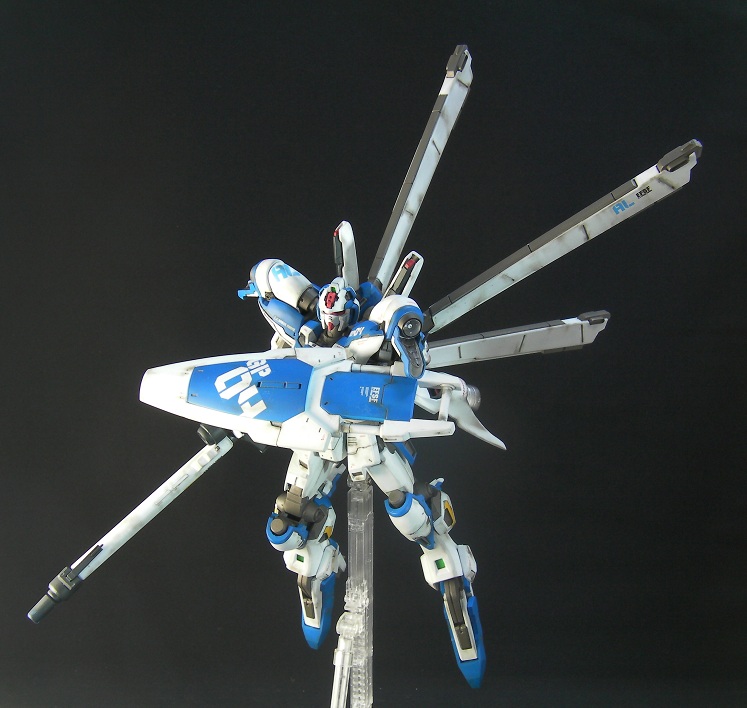
Find the location of a particular element. Image resolution: width=747 pixels, height=708 pixels. plastic display holder of toy is located at coordinates click(358, 561).